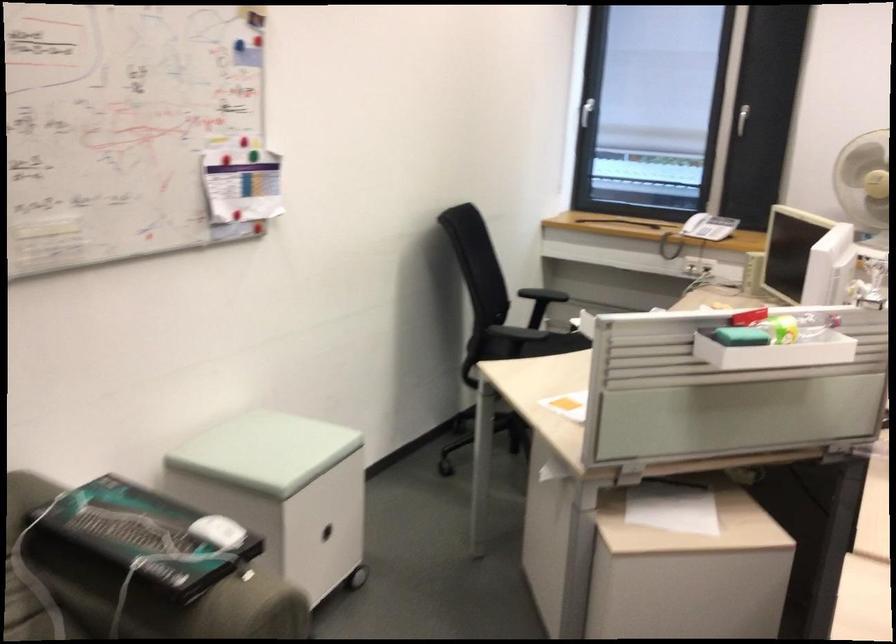
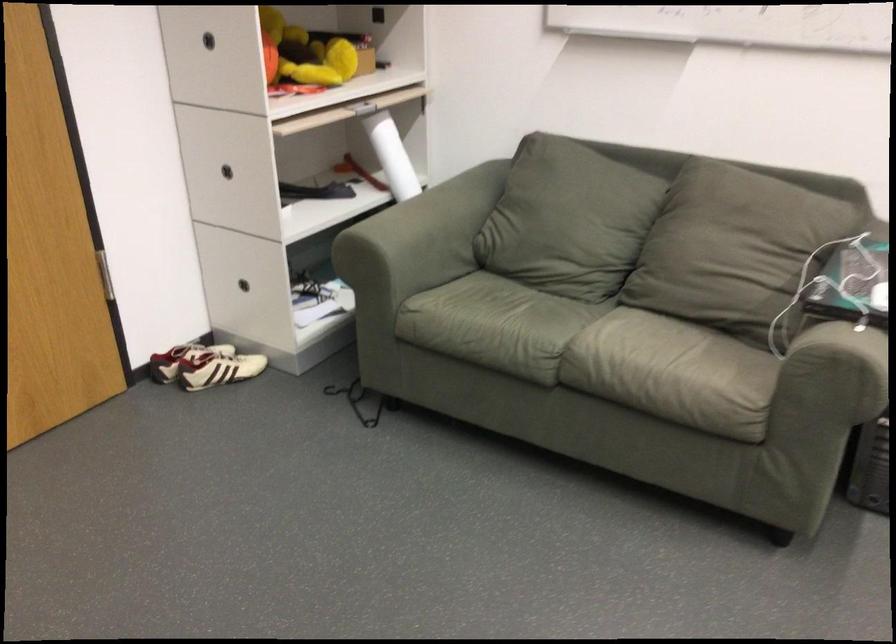
The point at (x=142, y=531) is marked in the first image. Where is the corresponding point in the second image?

(851, 279)